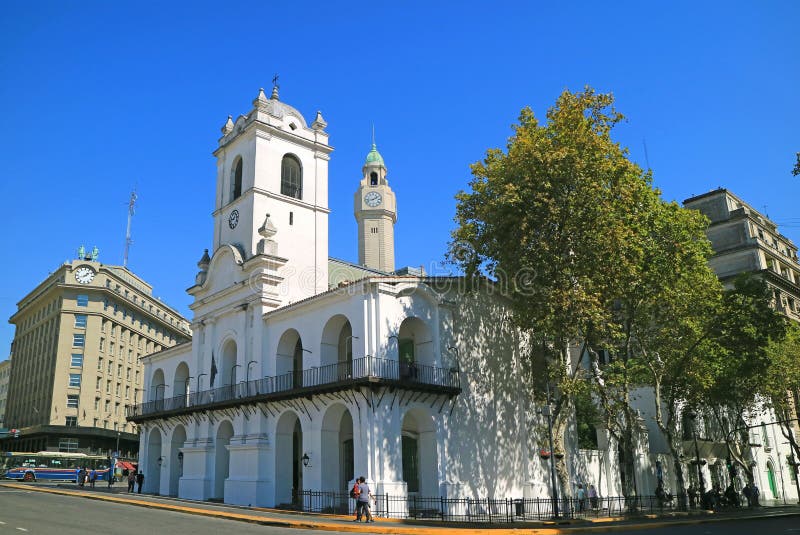
Find the location of a particular element. The height and width of the screenshot is (535, 800). clocks is located at coordinates (369, 202), (78, 277).